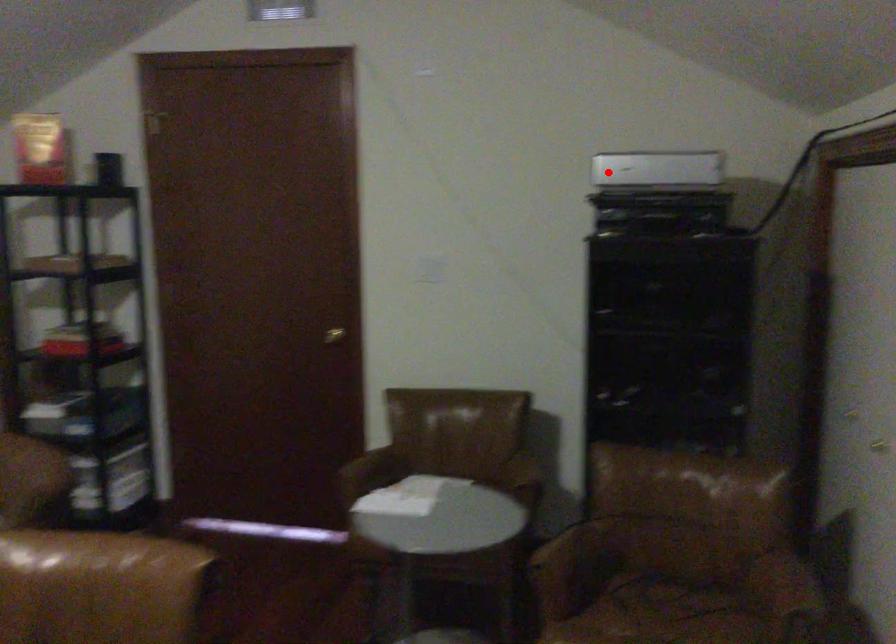
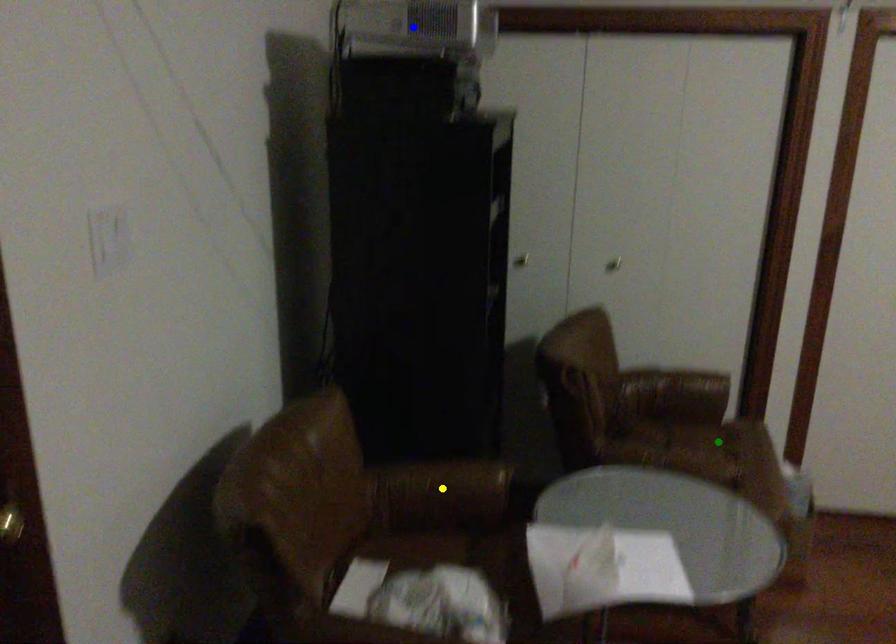
Question: I am providing you with two images of the same scene from different viewpoints. A red point is marked on the first image. You are given multiple points on the second image. Which point in image 2 is actually the same real-world point as the red point in image 1?

Choices:
 (A) blue point
 (B) yellow point
 (C) green point

Answer: (A)